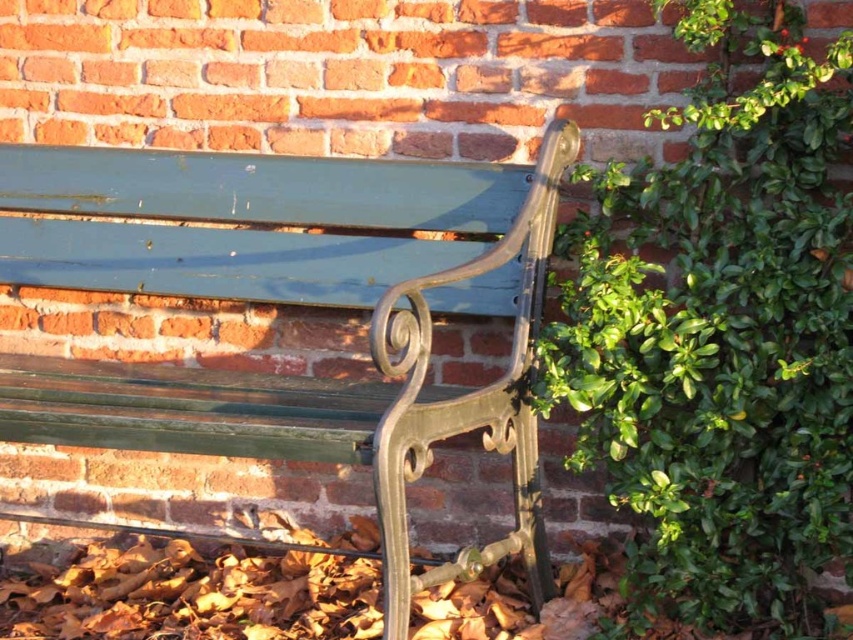
You are a gardener who needs to trim the green leafy ivy at right so it doesn t touch the green painted wood bench at center. Can you estimate whether the ivy needs to be trimmed?

The distance between the green leafy ivy at right and the green painted wood bench at center is 11.18 inches, which is sufficient to prevent the ivy from touching the bench. Therefore, trimming may not be necessary unless the ivy grows further.

You are standing in a garden and see the green leafy ivy at right and the green painted wood bench at center. Which object is positioned more to the east if the sunlight is coming from the west?

The green leafy ivy at right is positioned more to the east because it is to the right of the green painted wood bench at center, and since the sunlight is coming from the west, the right side of the bench would face east.